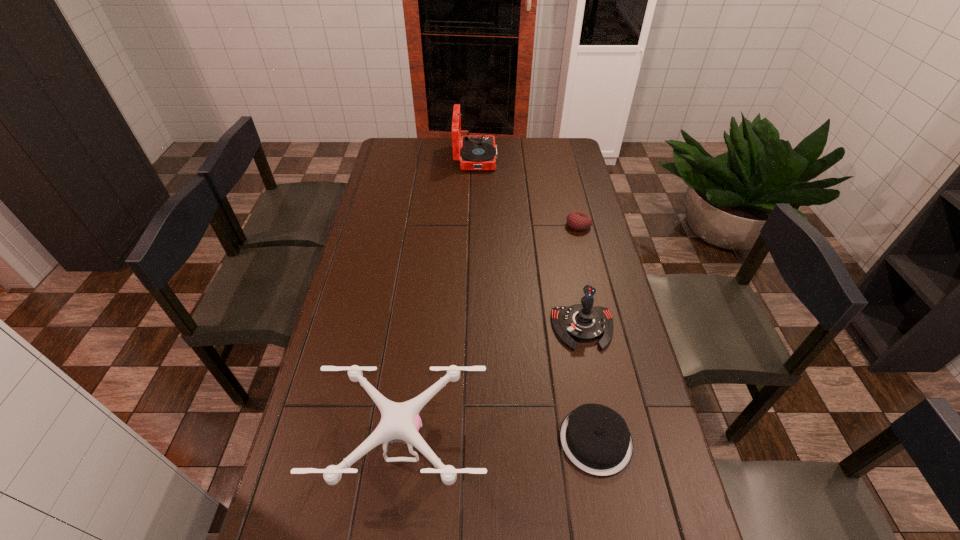
This screenshot has width=960, height=540. What are the coordinates of `phonograph_record` in the screenshot? It's located at (478, 152).

Image resolution: width=960 pixels, height=540 pixels. What are the coordinates of `the tallest object` in the screenshot? It's located at (x=478, y=152).

Where is `joystick`? The image size is (960, 540). joystick is located at coordinates (581, 322).

This screenshot has width=960, height=540. I want to click on drone, so click(x=400, y=422).

This screenshot has width=960, height=540. What are the coordinates of `the second farthest object` in the screenshot? It's located at (578, 221).

The image size is (960, 540). Find the location of `pancake`. pancake is located at coordinates (596, 439).

Find the location of a particular element. vacant space situated 0.300m on the front-facing side of the farthest object is located at coordinates (561, 158).

You are a GUI agent. You are given a task and a screenshot of the screen. Output one action in this format:
    pyautogui.click(x=<x>, y=<y>)
    Task: Click on the free space located on the handle side of the third farthest object
    This screenshot has height=540, width=960.
    Given the screenshot: What is the action you would take?
    pyautogui.click(x=610, y=462)

Locate an element on the screen. vacant space situated on the top of the drone is located at coordinates [x=394, y=526].

You are a GUI agent. You are given a task and a screenshot of the screen. Output one action in this format:
    pyautogui.click(x=<x>, y=<y>)
    Task: Click on the free spot located 0.310m on the left of the beanbag
    This screenshot has width=960, height=540.
    Given the screenshot: What is the action you would take?
    pyautogui.click(x=488, y=225)